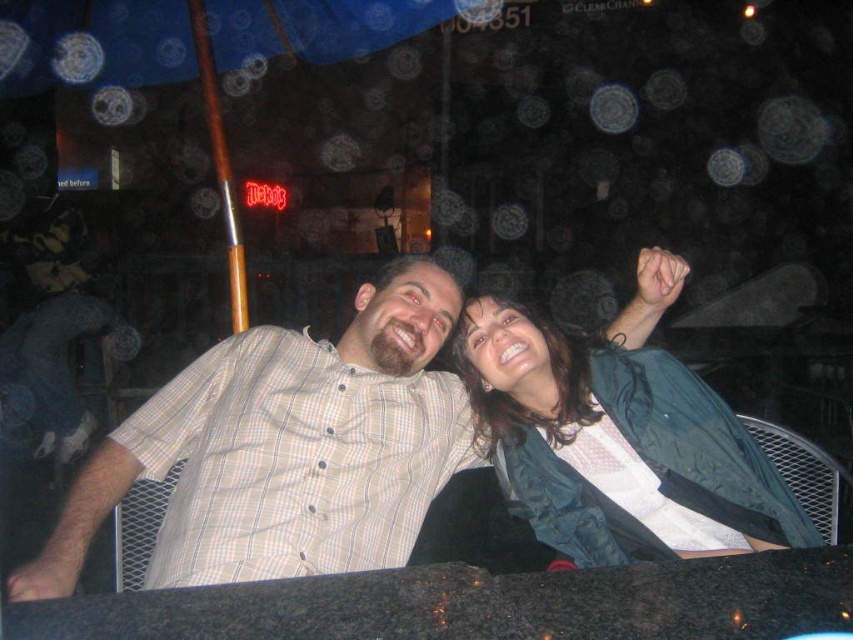
Does point (491, 364) come in front of point (102, 314)?

Yes, it is in front of point (102, 314).

At what (x,y) coordinates should I click in order to perform the action: click on plaid shirt at center. Please return your answer as a coordinate pair (x, y). Looking at the image, I should click on pyautogui.click(x=399, y=321).

Is green fabric jacket at upper right in front of light brown plaid shirt at left?

Yes, green fabric jacket at upper right is in front of light brown plaid shirt at left.

Image resolution: width=853 pixels, height=640 pixels. I want to click on green fabric jacket at upper right, so click(616, 445).

Does green fabric jacket at upper right have a greater width compared to plaid shirt at center?

Incorrect, green fabric jacket at upper right's width does not surpass plaid shirt at center's.

Does green fabric jacket at upper right have a lesser height compared to plaid shirt at center?

Yes.

Where is `green fabric jacket at upper right`? The width and height of the screenshot is (853, 640). green fabric jacket at upper right is located at coordinates (616, 445).